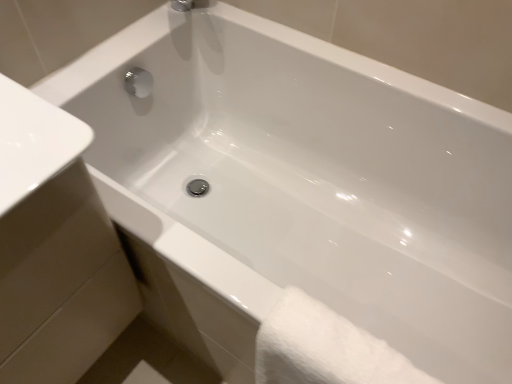
Question: From a real-world perspective, is white glossy sink at lower left physically below white fluffy towel at lower right?

Choices:
 (A) no
 (B) yes

Answer: (A)

Question: Is white glossy sink at lower left taller than white fluffy towel at lower right?

Choices:
 (A) no
 (B) yes

Answer: (B)

Question: Is white glossy sink at lower left not near white fluffy towel at lower right?

Choices:
 (A) no
 (B) yes

Answer: (A)

Question: Is white glossy sink at lower left thinner than white fluffy towel at lower right?

Choices:
 (A) yes
 (B) no

Answer: (B)

Question: Does white glossy sink at lower left turn towards white fluffy towel at lower right?

Choices:
 (A) no
 (B) yes

Answer: (B)

Question: Can you confirm if white glossy sink at lower left is positioned to the right of white fluffy towel at lower right?

Choices:
 (A) yes
 (B) no

Answer: (B)

Question: From the image's perspective, is white fluffy towel at lower right under white glossy sink at lower left?

Choices:
 (A) no
 (B) yes

Answer: (B)

Question: Would you say white fluffy towel at lower right is a long distance from white glossy sink at lower left?

Choices:
 (A) yes
 (B) no

Answer: (B)

Question: Does white fluffy towel at lower right appear on the right side of white glossy sink at lower left?

Choices:
 (A) no
 (B) yes

Answer: (B)

Question: Is white fluffy towel at lower right at the left side of white glossy sink at lower left?

Choices:
 (A) yes
 (B) no

Answer: (B)

Question: From the image's perspective, is white fluffy towel at lower right above white glossy sink at lower left?

Choices:
 (A) no
 (B) yes

Answer: (A)

Question: From a real-world perspective, is white fluffy towel at lower right physically above white glossy sink at lower left?

Choices:
 (A) no
 (B) yes

Answer: (A)

Question: Is point click(30, 124) closer or farther from the camera than point click(260, 357)?

Choices:
 (A) farther
 (B) closer

Answer: (B)